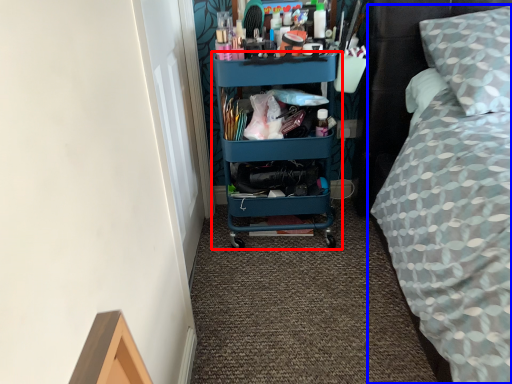
Question: Which point is closer to the camera, shelf (highlighted by a red box) or bed (highlighted by a blue box)?

Choices:
 (A) shelf
 (B) bed

Answer: (B)